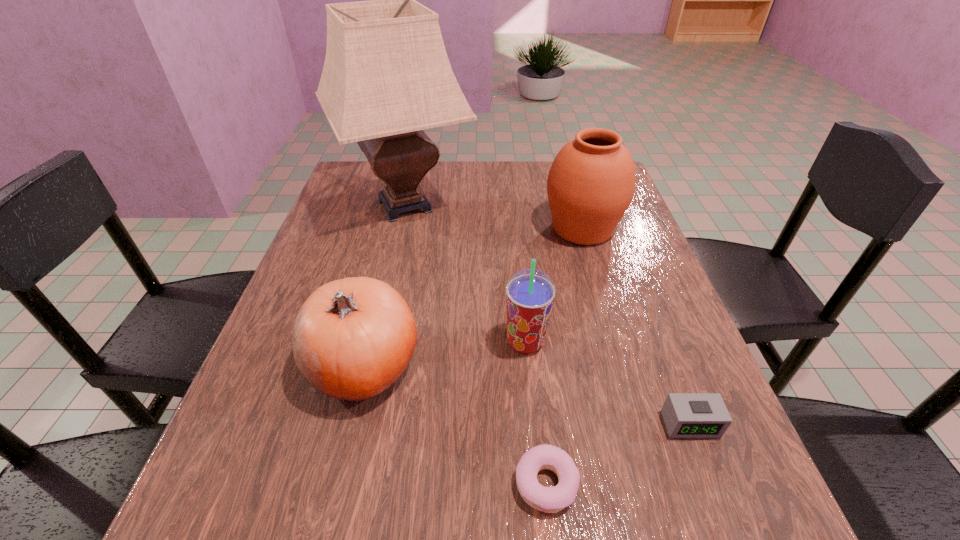
At what (x,y) coordinates should I click in order to perform the action: click on free region located 0.240m on the right of the pumpkin. Please return your answer as a coordinate pair (x, y). The width and height of the screenshot is (960, 540). Looking at the image, I should click on (552, 365).

Where is `free region located on the front-facing side of the alarm clock`? free region located on the front-facing side of the alarm clock is located at coordinates (718, 497).

Find the location of `vacant space located 0.280m on the back of the doughnut`. vacant space located 0.280m on the back of the doughnut is located at coordinates (528, 319).

The height and width of the screenshot is (540, 960). I want to click on object present at the far edge, so click(386, 77).

The width and height of the screenshot is (960, 540). Identify the location of object located at the near edge. (546, 499).

You are a GUI agent. You are given a task and a screenshot of the screen. Output one action in this format:
    pyautogui.click(x=<x>, y=<y>)
    Task: Click on the lampshade that is positioned at the left edge
    
    Given the screenshot: What is the action you would take?
    pyautogui.click(x=386, y=77)

You are a GUI agent. You are given a task and a screenshot of the screen. Output one action in this format:
    pyautogui.click(x=<x>, y=<y>)
    Task: Click on the pumpkin that is positioned at the left edge
    This screenshot has height=540, width=960.
    Given the screenshot: What is the action you would take?
    pyautogui.click(x=353, y=338)

In order to click on urn that is positioned at the right edge in this screenshot , I will do `click(591, 183)`.

Image resolution: width=960 pixels, height=540 pixels. I want to click on alarm clock located at the right edge, so click(686, 415).

What are the coordinates of `object at the far left corner` in the screenshot? It's located at (386, 77).